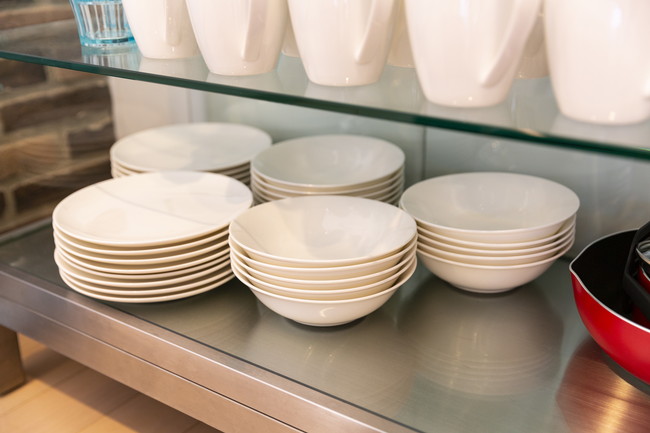
The image size is (650, 433). Identify the location of white mugs. (602, 61), (489, 38), (535, 42), (352, 47), (408, 51), (223, 28), (287, 36), (146, 20).